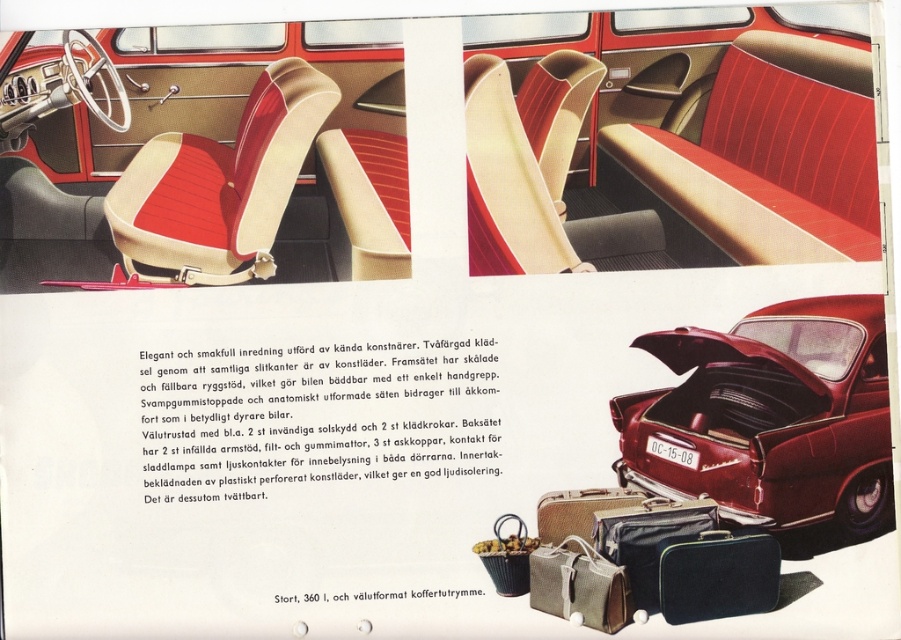
Which is above, shiny red car trunk at lower right or matte black suitcase at lower right?

shiny red car trunk at lower right

Is shiny red car trunk at lower right shorter than matte black suitcase at lower right?

Incorrect, shiny red car trunk at lower right's height does not fall short of matte black suitcase at lower right's.

Does point (754, 394) lie in front of point (628, 525)?

That is False.

Image resolution: width=901 pixels, height=640 pixels. I want to click on shiny red car trunk at lower right, so click(770, 417).

Can you confirm if black fabric suitcase at lower right is positioned below textured canvas bag at lower center?

No, black fabric suitcase at lower right is not below textured canvas bag at lower center.

The image size is (901, 640). What do you see at coordinates (717, 577) in the screenshot? I see `black fabric suitcase at lower right` at bounding box center [717, 577].

Is point (661, 595) closer to viewer compared to point (587, 614)?

Yes, point (661, 595) is closer to viewer.

Where is `black fabric suitcase at lower right`? The height and width of the screenshot is (640, 901). black fabric suitcase at lower right is located at coordinates (717, 577).

Who is taller, textured canvas bag at lower center or leather suitcase at lower center?

textured canvas bag at lower center is taller.

This screenshot has width=901, height=640. Identify the location of textured canvas bag at lower center. (579, 584).

Does point (587, 614) come behind point (578, 532)?

No, (587, 614) is in front of (578, 532).

Locate an element on the screen. This screenshot has height=640, width=901. textured canvas bag at lower center is located at coordinates (579, 584).